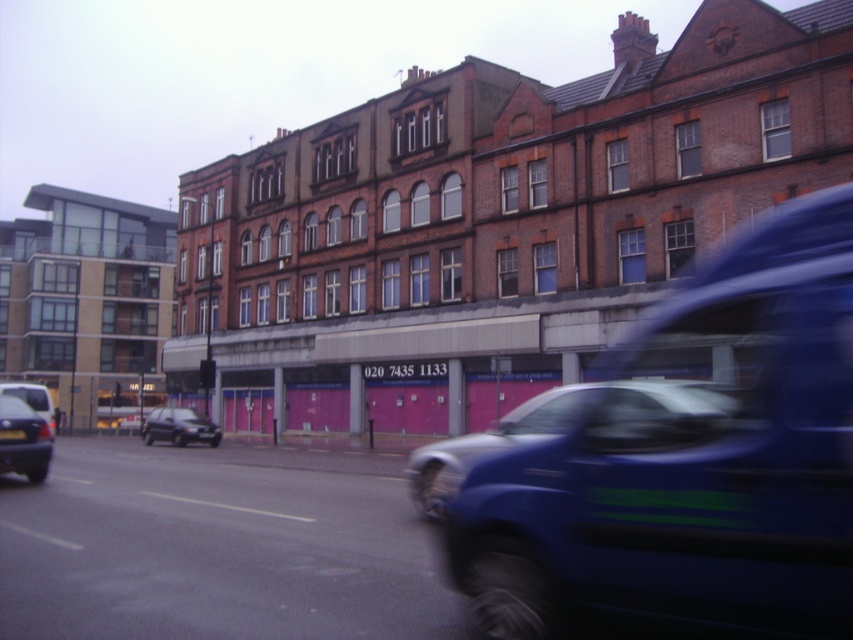
Does metallic blue van at center have a lesser width compared to metallic blue car at center?

No, metallic blue van at center is not thinner than metallic blue car at center.

Describe the element at coordinates (691, 456) in the screenshot. I see `metallic blue van at center` at that location.

Find the location of a particular element. metallic blue van at center is located at coordinates (691, 456).

Between point (430, 454) and point (27, 401), which one is positioned behind?

Point (27, 401)

Between metallic blue car at center and matte black van at left, which one is positioned lower?

matte black van at left

You are a GUI agent. You are given a task and a screenshot of the screen. Output one action in this format:
    pyautogui.click(x=<x>, y=<y>)
    Task: Click on the metallic blue car at center
    The image size is (853, 640).
    Given the screenshot: What is the action you would take?
    pyautogui.click(x=491, y=444)

Where is `metallic blue car at center`? The image size is (853, 640). metallic blue car at center is located at coordinates (491, 444).

Is metallic blue car at center below black metallic car at lower left?

Yes, metallic blue car at center is below black metallic car at lower left.

Can you confirm if metallic blue car at center is positioned above black metallic car at lower left?

Incorrect, metallic blue car at center is not positioned above black metallic car at lower left.

The height and width of the screenshot is (640, 853). Describe the element at coordinates (491, 444) in the screenshot. I see `metallic blue car at center` at that location.

The image size is (853, 640). Identify the location of metallic blue car at center. (491, 444).